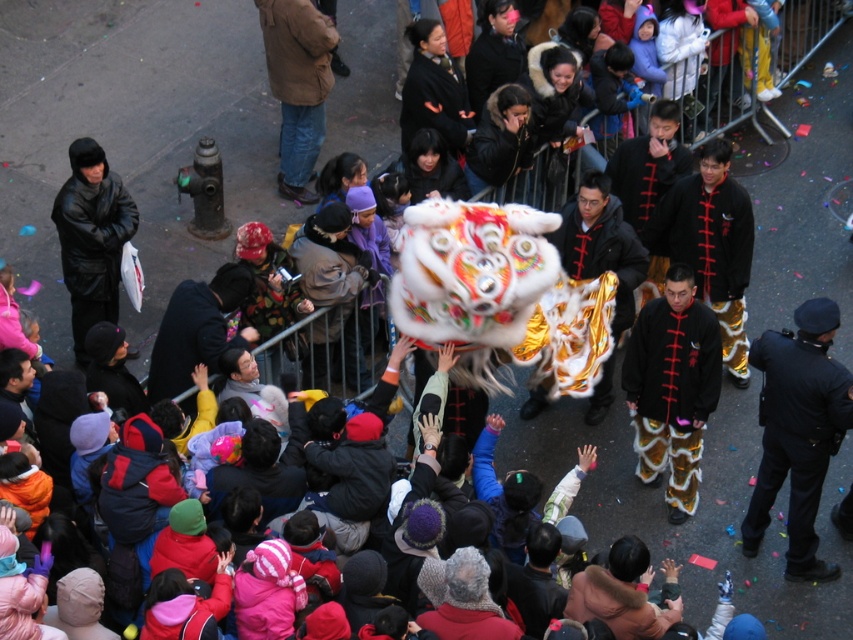
Question: Which point is farther to the camera?

Choices:
 (A) black satin jacket at center
 (B) brown leather jacket at upper center

Answer: (B)

Question: Can you confirm if black satin jacket at center is thinner than black leather jacket at upper left?

Choices:
 (A) no
 (B) yes

Answer: (A)

Question: Does black uniform at right appear on the left side of black satin jacket at center?

Choices:
 (A) no
 (B) yes

Answer: (A)

Question: From the image, what is the correct spatial relationship of black uniform at right in relation to brown leather jacket at upper center?

Choices:
 (A) above
 (B) below

Answer: (B)

Question: Which object appears closest to the camera in this image?

Choices:
 (A) black leather jacket at upper left
 (B) brown leather jacket at upper center
 (C) black satin jacket at center

Answer: (C)

Question: Which of the following is the closest to the observer?

Choices:
 (A) (265, 12)
 (B) (115, 280)
 (C) (788, 452)

Answer: (C)